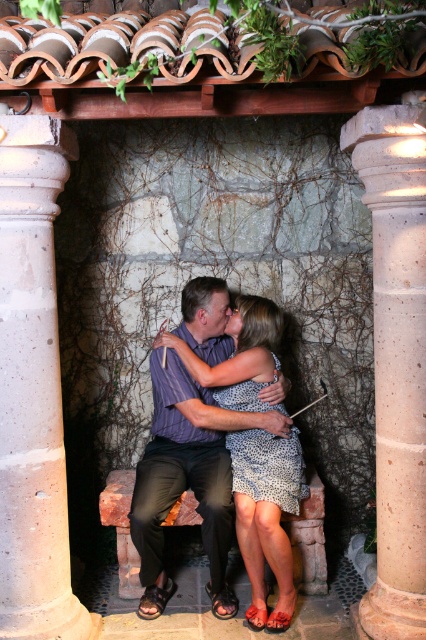
You are an architect designing a new garden alcove. You need to ensure there is enough space between the white concrete column at left and the matte purple shirt at center for a visitor to comfortably pass through. Can you confirm if the space is sufficient?

The white concrete column at left is positioned over matte purple shirt at center, which means they are vertically aligned. This suggests there is no horizontal space between them, so a visitor cannot comfortably pass through.

You are designing a garden path that needs to pass between the white concrete column at left and the speckled stone column at right. Given their sizes, which column would require a wider space to accommodate its base?

The white concrete column at left is larger in size than the speckled stone column at right, so it would require a wider space to accommodate its base.